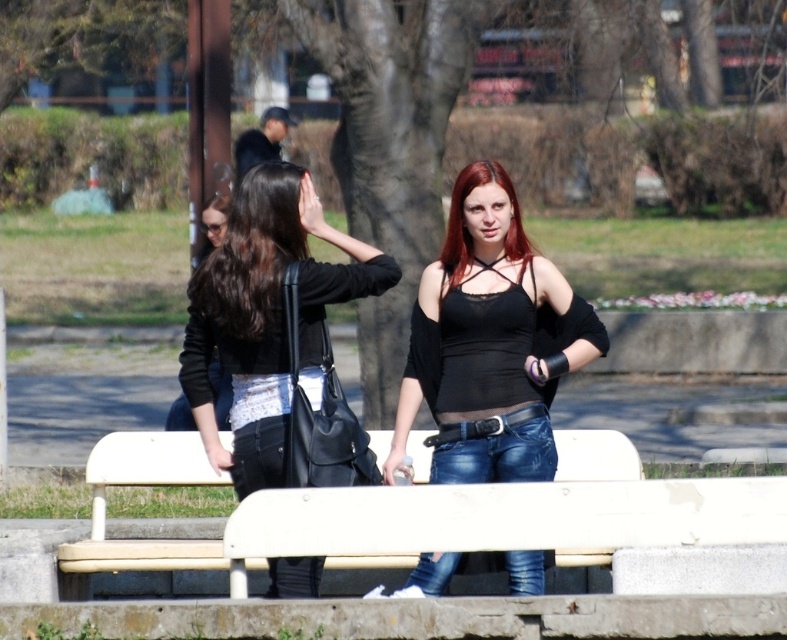
Question: Observing the image, what is the correct spatial positioning of white plastic bench at lower center in reference to dark red hair at center?

Choices:
 (A) right
 (B) left

Answer: (B)

Question: Estimate the real-world distances between objects in this image. Which object is closer to the dark red hair at center?

Choices:
 (A) black matte tank top at center
 (B) black leather jacket at center

Answer: (A)

Question: Where is dark brown silky hair at center located in relation to dark red hair at center in the image?

Choices:
 (A) above
 (B) below

Answer: (B)

Question: Considering the real-world distances, which object is closest to the black matte tank top at center?

Choices:
 (A) dark red hair at center
 (B) dark brown silky hair at center
 (C) white plastic bench at lower center
 (D) black leather jacket at center

Answer: (A)

Question: Can you confirm if black leather jacket at center is positioned below denim jeans at center?

Choices:
 (A) no
 (B) yes

Answer: (A)

Question: Among these objects, which one is nearest to the camera?

Choices:
 (A) black matte tank top at center
 (B) dark red hair at center

Answer: (A)